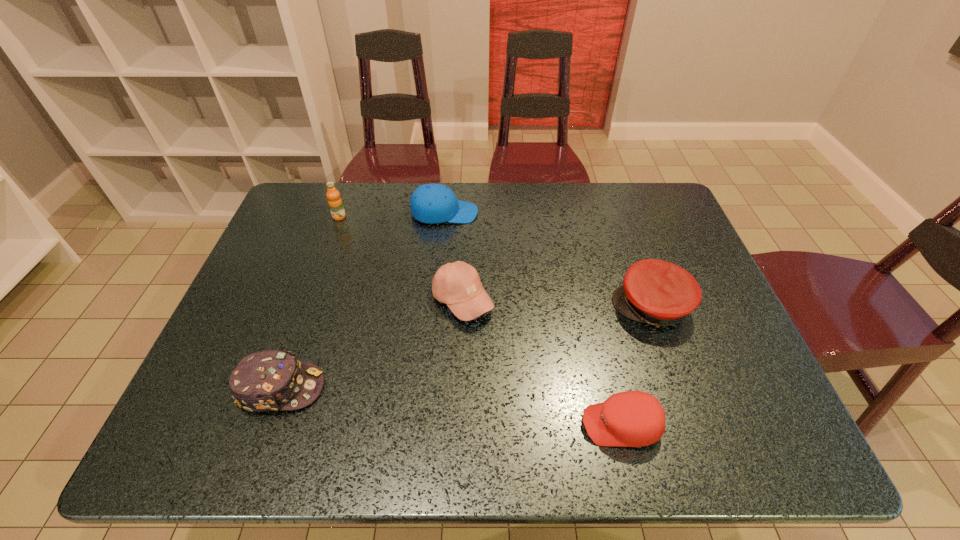
You are a GUI agent. You are given a task and a screenshot of the screen. Output one action in this format:
    pyautogui.click(x=<x>, y=<y>)
    Task: Click on the orange juice
    This screenshot has width=960, height=540.
    Given the screenshot: What is the action you would take?
    pyautogui.click(x=335, y=203)

The width and height of the screenshot is (960, 540). I want to click on the farthest cap, so click(433, 203).

Where is `baseball cap`? Image resolution: width=960 pixels, height=540 pixels. baseball cap is located at coordinates (458, 285).

Locate an element on the screen. Image resolution: width=960 pixels, height=540 pixels. the third nearest cap is located at coordinates (656, 292).

In order to click on the leftmost cap in this screenshot , I will do `click(271, 380)`.

You are a GUI agent. You are given a task and a screenshot of the screen. Output one action in this format:
    pyautogui.click(x=<x>, y=<y>)
    Task: Click on the vacant space located 0.170m on the label of the tallest object
    The height and width of the screenshot is (540, 960).
    Given the screenshot: What is the action you would take?
    pyautogui.click(x=324, y=259)

Identify the location of vacant area situated on the front-facing side of the farthest cap. The width and height of the screenshot is (960, 540). (522, 213).

The height and width of the screenshot is (540, 960). I want to click on vacant space located on the front-facing side of the baseball cap, so 606,300.

This screenshot has width=960, height=540. I want to click on vacant region located 0.290m on the front of the third nearest cap with an emblem, so click(499, 307).

Locate an element on the screen. vacant space positioned on the front of the third nearest cap with an emblem is located at coordinates (x=492, y=307).